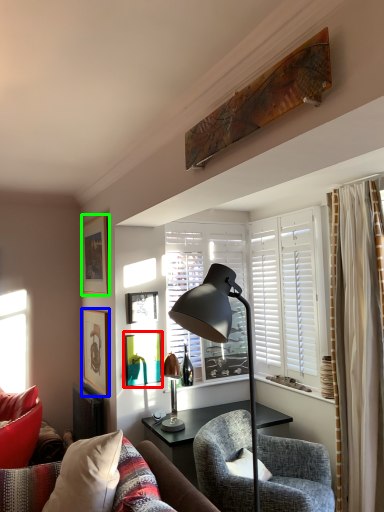
Question: Which object is the closest to the picture frame (highlighted by a red box)? Choose among these: picture frame (highlighted by a blue box) or picture frame (highlighted by a green box).

Choices:
 (A) picture frame
 (B) picture frame

Answer: (A)